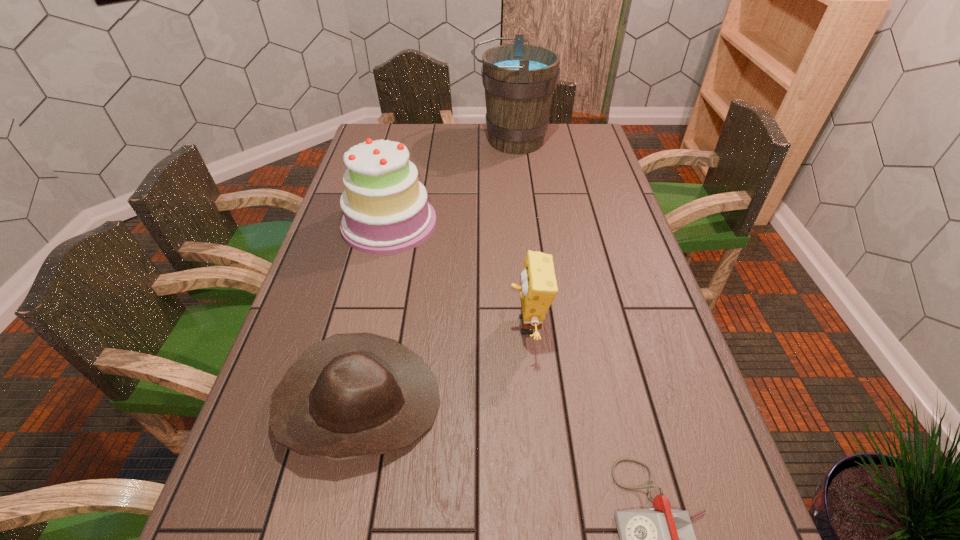
Find the location of a particular element. The image size is (960, 540). the farthest object is located at coordinates (519, 79).

Locate an element on the screen. This screenshot has width=960, height=540. wine bucket is located at coordinates (519, 79).

Find the location of a particular element. Image resolution: width=960 pixels, height=540 pixels. cake is located at coordinates (386, 211).

You are a GUI agent. You are given a task and a screenshot of the screen. Output one action in this format:
    pyautogui.click(x=<x>, y=<y>)
    Task: Click on the second tallest object
    
    Given the screenshot: What is the action you would take?
    pyautogui.click(x=386, y=211)

Locate an element on the screen. The width and height of the screenshot is (960, 540). the third shortest object is located at coordinates (538, 289).

Locate an element on the screen. This screenshot has width=960, height=540. cowboy hat is located at coordinates (354, 395).

Where is `free space located 0.190m with a handle on the side of the tallest object`? The height and width of the screenshot is (540, 960). free space located 0.190m with a handle on the side of the tallest object is located at coordinates (423, 140).

In order to click on blank area located with a handle on the side of the tallest object in this screenshot , I will do `click(375, 140)`.

This screenshot has width=960, height=540. What are the coordinates of `free space located 0.340m with a handle on the side of the tallest object` in the screenshot? It's located at (385, 140).

Find the location of a particular element. This screenshot has height=540, width=960. free region located on the back of the fourth nearest object is located at coordinates (408, 144).